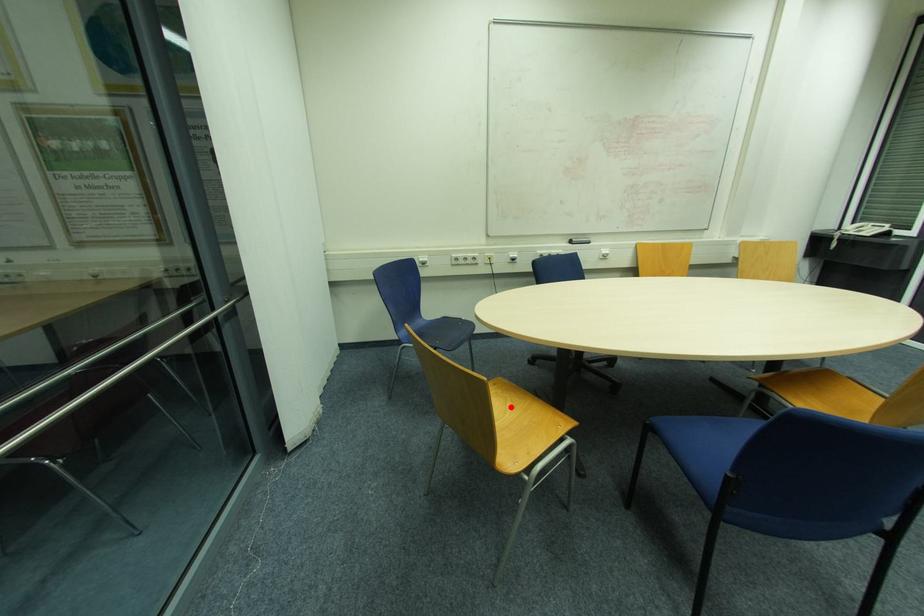
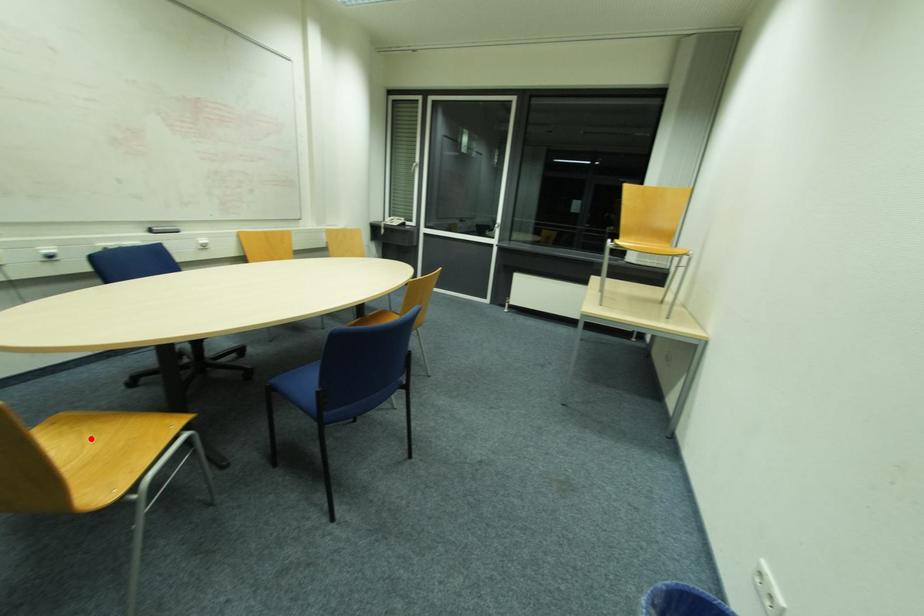
I am providing you with two images of the same scene from different viewpoints. A red point is marked on the first image and another point is marked on the second image. Is the marked point in image1 the same physical position as the marked point in image2?

Yes